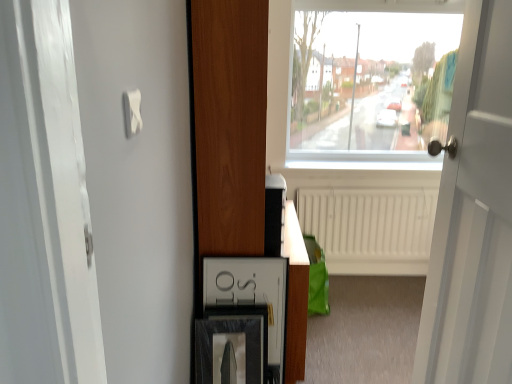
Question: Is point (437, 284) closer or farther from the camera than point (261, 316)?

Choices:
 (A) closer
 (B) farther

Answer: (A)

Question: Would you say white wooden door at right is inside or outside matte black picture frame at lower center?

Choices:
 (A) inside
 (B) outside

Answer: (B)

Question: Estimate the real-world distances between objects in this image. Which object is closer to the matte black picture frame at lower center?

Choices:
 (A) white glossy dresser at center
 (B) white wooden door at right
 (C) matte black medicine cabinet at lower center
 (D) white matte radiator at center

Answer: (C)

Question: Considering the real-world distances, which object is closest to the matte black picture frame at lower center?

Choices:
 (A) matte black medicine cabinet at lower center
 (B) white matte radiator at center
 (C) white glossy dresser at center
 (D) white wooden door at right

Answer: (A)